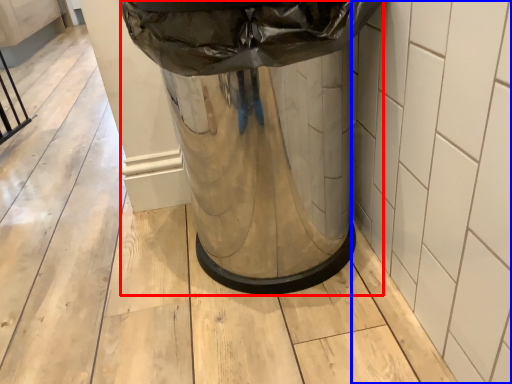
Question: Which of the following is the closest to the observer, waste container (highlighted by a red box) or tile (highlighted by a blue box)?

Choices:
 (A) waste container
 (B) tile

Answer: (B)